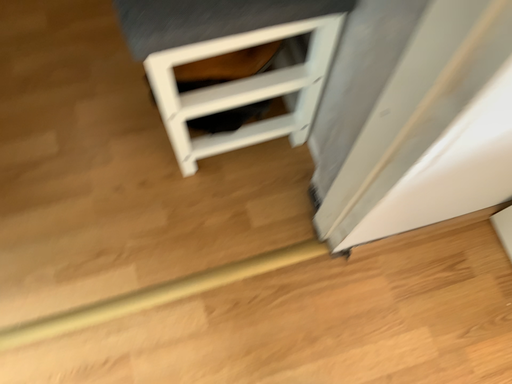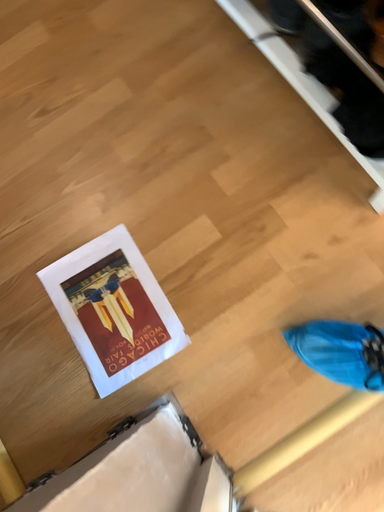
Question: Which way did the camera rotate in the video?

Choices:
 (A) rotated downward
 (B) rotated upward

Answer: (A)